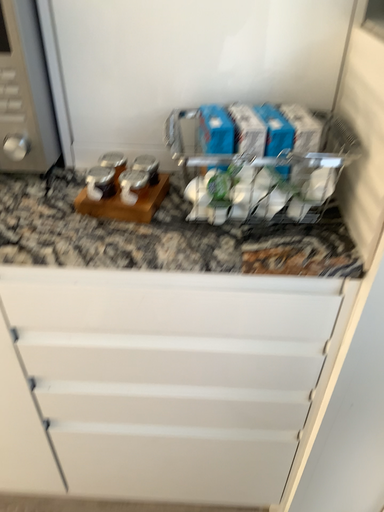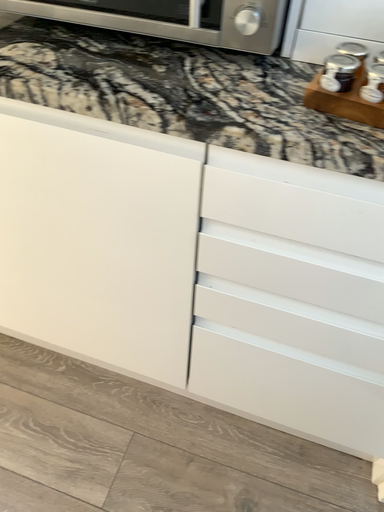
Question: How did the camera likely rotate when shooting the video?

Choices:
 (A) rotated upward
 (B) rotated downward

Answer: (B)